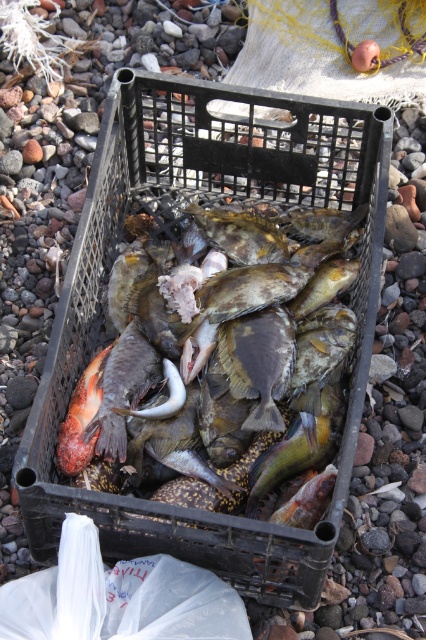
Question: Which point appears farthest from the camera in this image?

Choices:
 (A) (100, 406)
 (B) (172, 342)
 (C) (242, 221)

Answer: (C)

Question: Which object appears farthest from the camera in this image?

Choices:
 (A) shiny golden fish at center
 (B) shiny orange fish at lower left

Answer: (A)

Question: Is shiny silver fish at center behind shiny orange fish at lower left?

Choices:
 (A) no
 (B) yes

Answer: (B)

Question: Can you confirm if shiny silver fish at center is smaller than shiny orange fish at lower left?

Choices:
 (A) no
 (B) yes

Answer: (A)

Question: Which point is closer to the camera taking this photo?

Choices:
 (A) (268, 228)
 (B) (109, 429)
 (C) (74, 397)

Answer: (B)

Question: Does shiny silver fish at center appear on the left side of shiny golden fish at center?

Choices:
 (A) yes
 (B) no

Answer: (A)